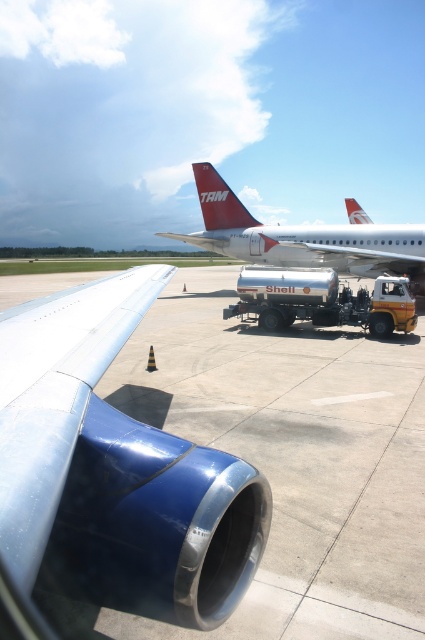
Question: Among these points, which one is nearest to the camera?

Choices:
 (A) (67, 378)
 (B) (329, 230)

Answer: (A)

Question: Does blue metallic engine at center appear over metallic silver airplane at center?

Choices:
 (A) yes
 (B) no

Answer: (B)

Question: Is blue metallic engine at center thinner than metallic silver airplane at center?

Choices:
 (A) yes
 (B) no

Answer: (A)

Question: Which object is closer to the camera taking this photo?

Choices:
 (A) blue metallic engine at center
 (B) metallic silver airplane at center

Answer: (A)

Question: Considering the relative positions of blue metallic engine at center and metallic silver airplane at center in the image provided, where is blue metallic engine at center located with respect to metallic silver airplane at center?

Choices:
 (A) left
 (B) right

Answer: (A)

Question: Which of the following is the closest to the observer?

Choices:
 (A) metallic silver airplane at center
 (B) blue metallic engine at center

Answer: (B)